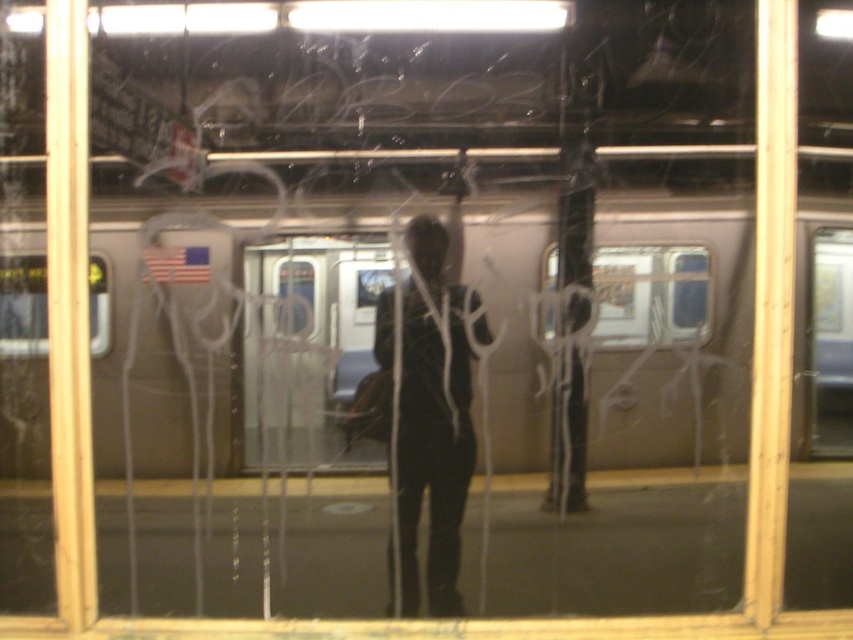
Who is shorter, black matte clothing at center or clear glass train window at center?

Standing shorter between the two is clear glass train window at center.

You are a GUI agent. You are given a task and a screenshot of the screen. Output one action in this format:
    pyautogui.click(x=<x>, y=<y>)
    Task: Click on the black matte clothing at center
    This screenshot has width=853, height=640.
    Given the screenshot: What is the action you would take?
    pyautogui.click(x=432, y=426)

Does point (405, 554) come behind point (703, 314)?

Yes.

Locate an element on the screen. The width and height of the screenshot is (853, 640). black matte clothing at center is located at coordinates (432, 426).

Between silver metallic train at center and black matte clothing at center, which one appears on the left side from the viewer's perspective?

Positioned to the left is silver metallic train at center.

Between point (251, 284) and point (431, 508), which one is positioned in front?

Point (251, 284)

Between point (689, 348) and point (425, 323), which one is positioned in front?

Point (689, 348)

Where is `silver metallic train at center`? This screenshot has height=640, width=853. silver metallic train at center is located at coordinates click(595, 332).

Does silver metallic train at center have a lesser width compared to clear glass train window at center?

No.

Which is above, silver metallic train at center or clear glass train window at center?

Positioned higher is clear glass train window at center.

Does point (131, 298) lie in front of point (665, 321)?

That is True.

I want to click on silver metallic train at center, so click(595, 332).